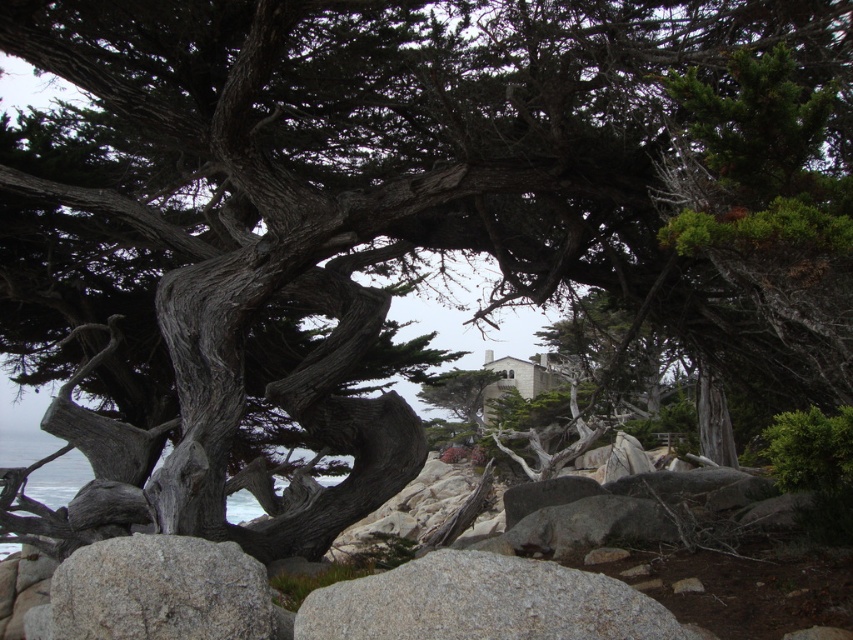
Question: Among these points, which one is farthest from the camera?

Choices:
 (A) (171, 556)
 (B) (521, 604)

Answer: (A)

Question: Which point appears closest to the camera in this image?

Choices:
 (A) (392, 595)
 (B) (167, 609)

Answer: (A)

Question: Can you confirm if gray granite boulder at lower center is positioned below gray rough rock at lower left?

Choices:
 (A) yes
 (B) no

Answer: (B)

Question: Is gray granite boulder at lower center bigger than gray rough rock at lower left?

Choices:
 (A) yes
 (B) no

Answer: (A)

Question: Is gray granite boulder at lower center above gray rough rock at lower left?

Choices:
 (A) yes
 (B) no

Answer: (A)

Question: Which point is closer to the camera taking this photo?

Choices:
 (A) (432, 557)
 (B) (178, 618)

Answer: (A)